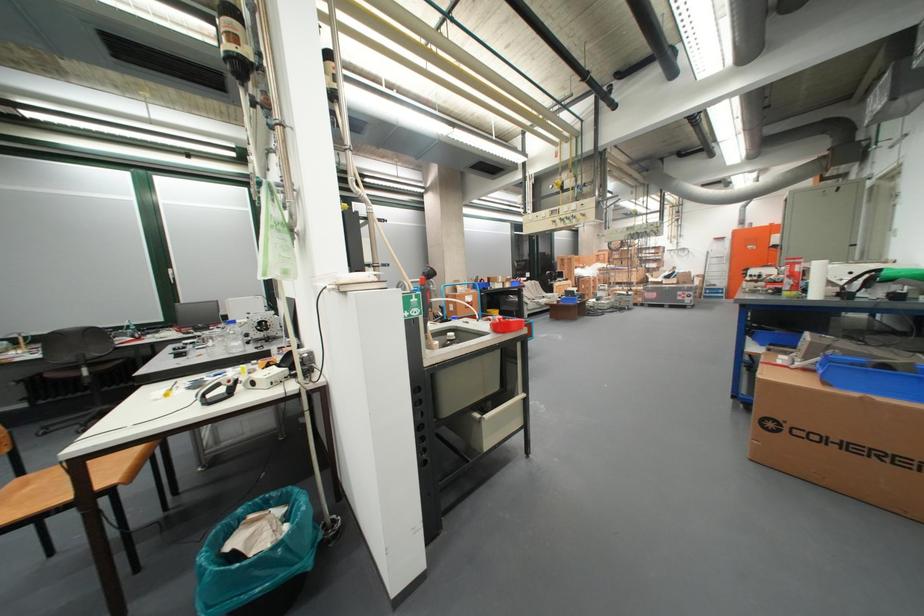
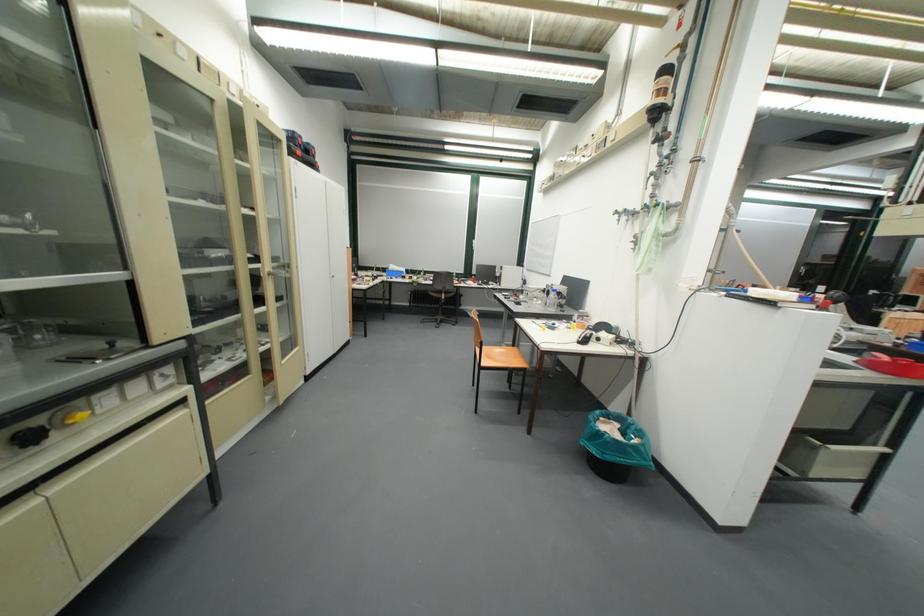
Where in the second image is the point corresponding to (x=262, y=517) from the first image?

(614, 419)